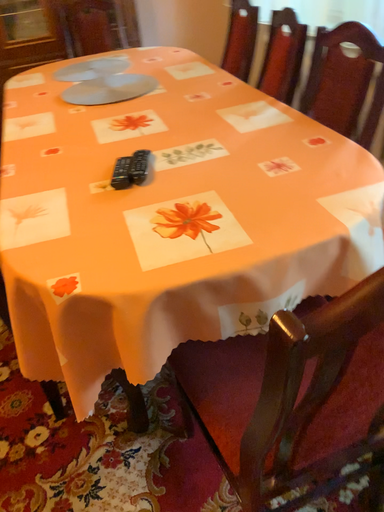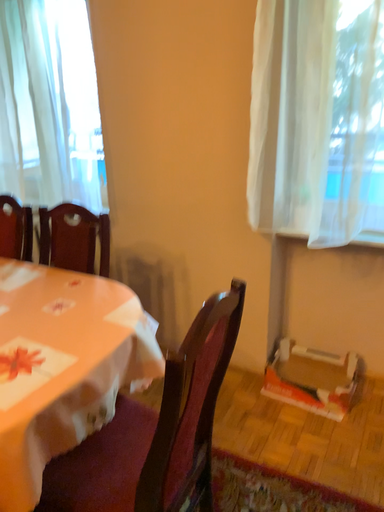
Question: How did the camera likely rotate when shooting the video?

Choices:
 (A) rotated upward
 (B) rotated downward

Answer: (A)